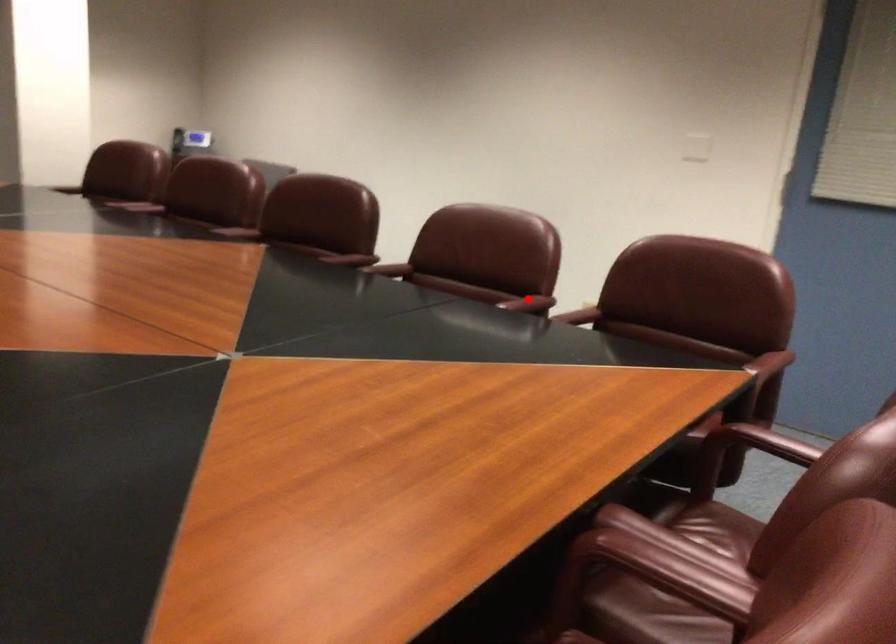
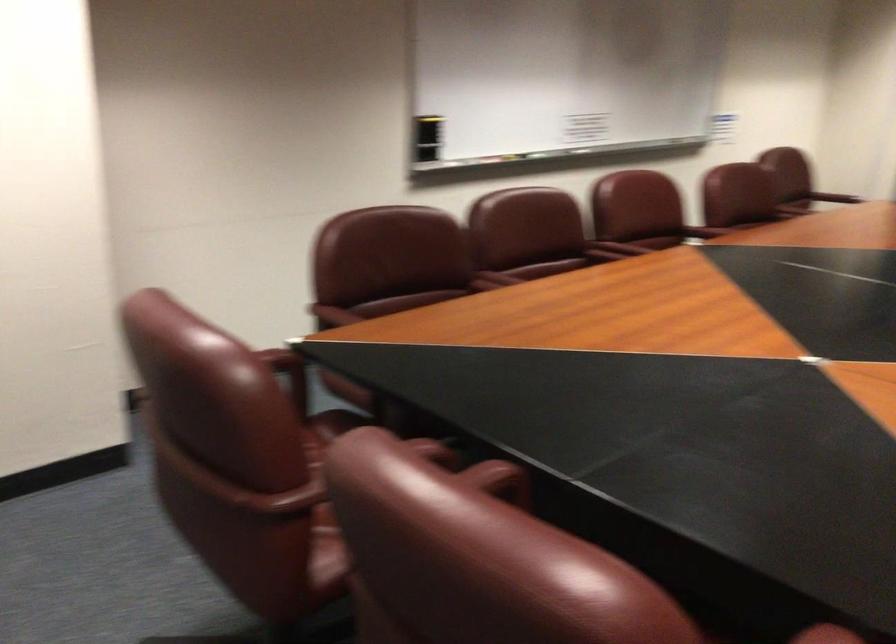
Question: A red point is marked in image1. In image2, is the corresponding 3D point closer to the camera or farther? Reply with the corresponding letter.

Choices:
 (A) The corresponding 3D point is closer.
 (B) The corresponding 3D point is farther.

Answer: (A)